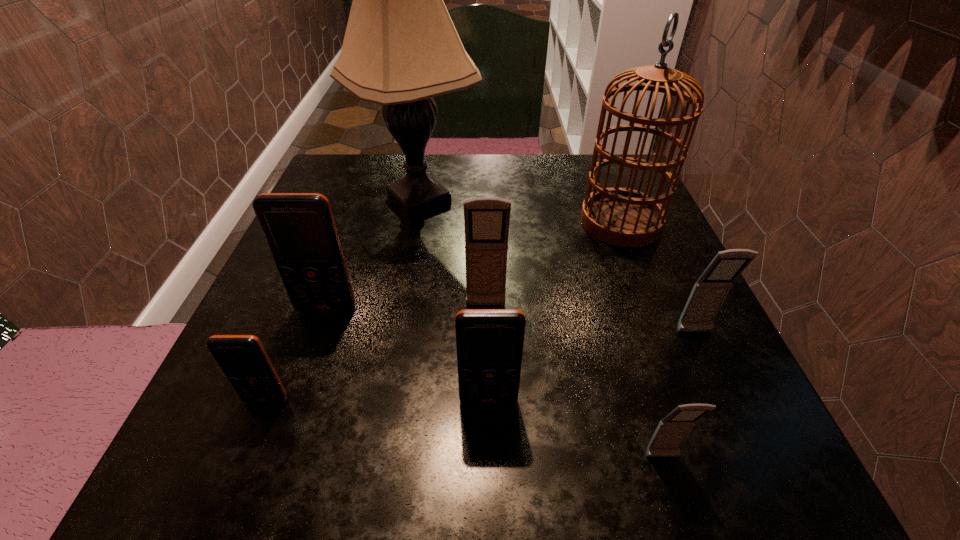
You are a GUI agent. You are given a task and a screenshot of the screen. Output one action in this format:
    pyautogui.click(x=<x>, y=<y>)
    Task: Click on the birdcage positioned at the far edge
    This screenshot has width=960, height=540.
    Given the screenshot: What is the action you would take?
    pyautogui.click(x=624, y=217)

The height and width of the screenshot is (540, 960). Identify the location of object that is at the near edge. (671, 432).

Find the location of `lamp that is positioned at the left edge`. lamp that is positioned at the left edge is located at coordinates (400, 49).

Locate an element on the screen. This screenshot has height=540, width=960. birdcage that is at the right edge is located at coordinates (624, 217).

Identify the location of object positioned at the far left corner. (400, 49).

Find the location of `object that is at the far right corner`. object that is at the far right corner is located at coordinates (624, 217).

Where is `object present at the near right corner`? This screenshot has width=960, height=540. object present at the near right corner is located at coordinates (671, 432).

Find the location of a particular element. Image resolution: width=960 pixels, height=540 pixels. free space at the far edge of the desktop is located at coordinates (540, 167).

In the image, there is a desktop. Where is `vacant space at the near edge`? This screenshot has height=540, width=960. vacant space at the near edge is located at coordinates (610, 430).

Identify the location of vacant space at the left edge of the desktop. (315, 345).